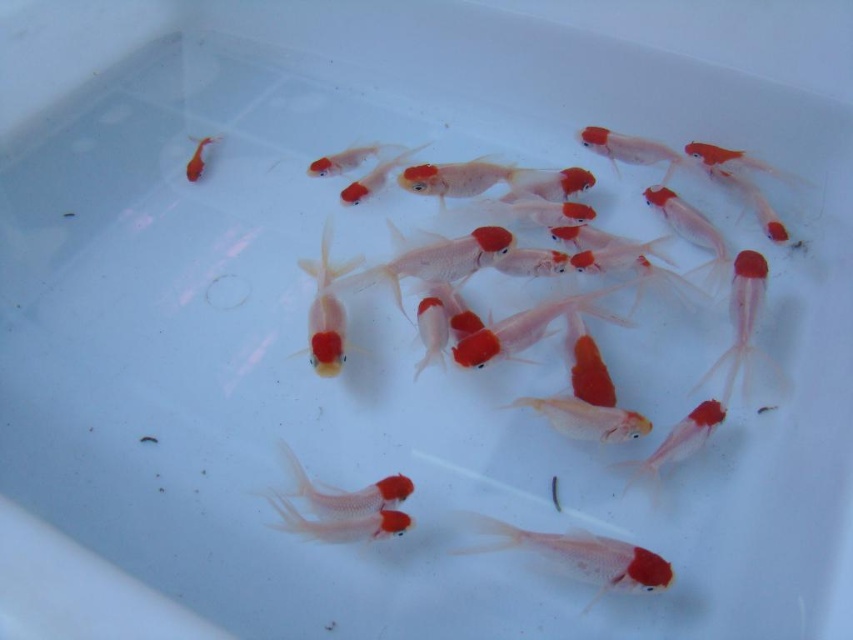
Question: Is matte white goldfish at center bigger than matte orange goldfish at upper left?

Choices:
 (A) yes
 (B) no

Answer: (A)

Question: Where is translucent white goldfish at center located in relation to matte orange goldfish at upper left in the image?

Choices:
 (A) above
 (B) below

Answer: (B)

Question: Among these objects, which one is farthest from the camera?

Choices:
 (A) matte orange goldfish at upper left
 (B) translucent white goldfish at center

Answer: (A)

Question: Which point is closer to the camera?

Choices:
 (A) translucent white goldfish at center
 (B) matte orange goldfish at upper left

Answer: (A)

Question: Which point is farther to the camera?

Choices:
 (A) (405, 484)
 (B) (207, 141)

Answer: (B)

Question: Is translucent white goldfish at center below matte white goldfish at center?

Choices:
 (A) yes
 (B) no

Answer: (A)